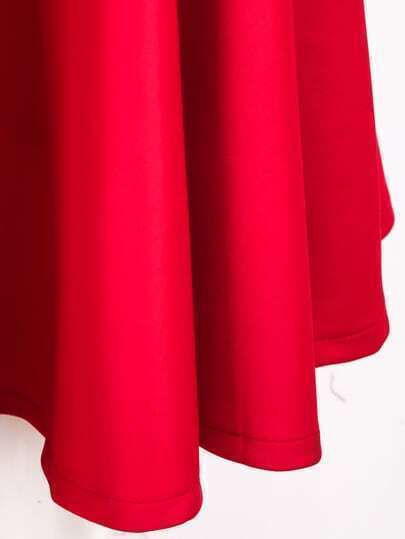
I want to click on table cover, so click(265, 386).